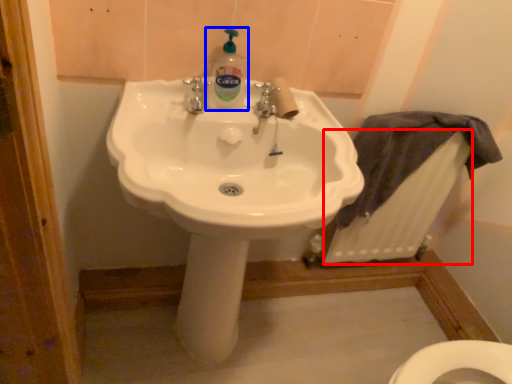
Question: Which object appears farthest to the camera in this image, radiator (highlighted by a red box) or cleaning product (highlighted by a blue box)?

Choices:
 (A) radiator
 (B) cleaning product

Answer: (A)